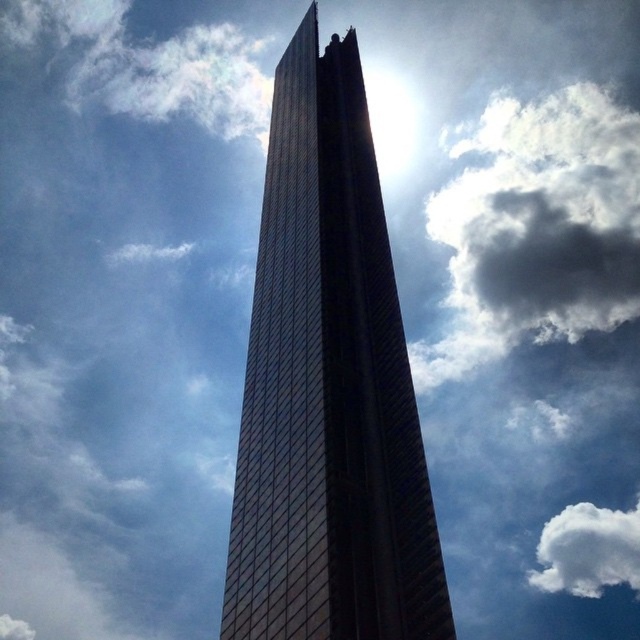
Looking at the scene, which object is positioned to the right side of the other between the shiny glass tower at center and the white fluffy cloud at upper right?

The white fluffy cloud at upper right is positioned to the right of the shiny glass tower at center.

You are standing in front of the skyscraper and notice a specific point marked at coordinates point (328, 388). Based on the scene description, where exactly is this point located on the shiny glass tower at center?

The point (328, 388) is located on the shiny glass tower at center.

You are a photographer trying to capture the white fluffy cloud at upper right without the shiny glass tower at center blocking it. What should you do?

Move to the right or left so that the shiny glass tower at center is no longer between you and the white fluffy cloud at upper right.